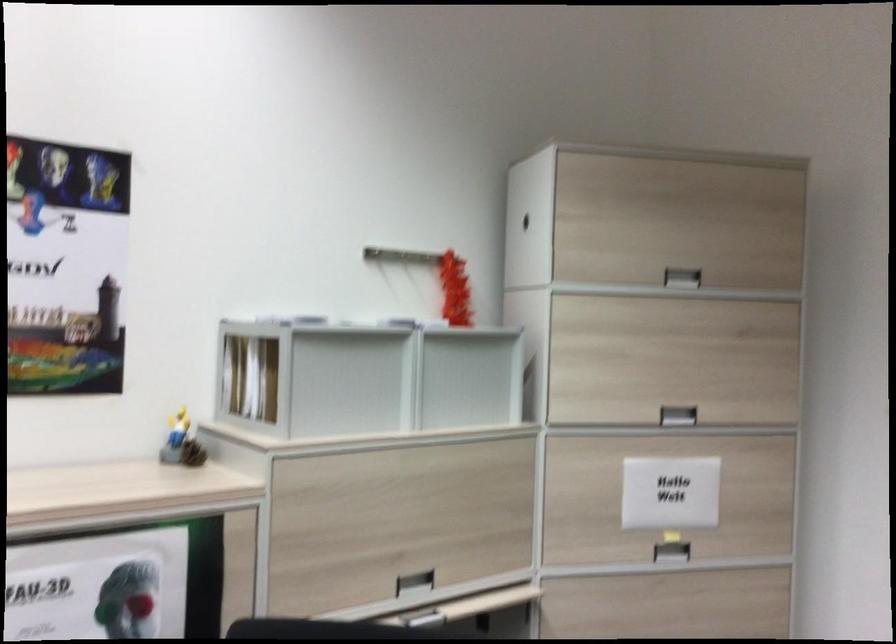
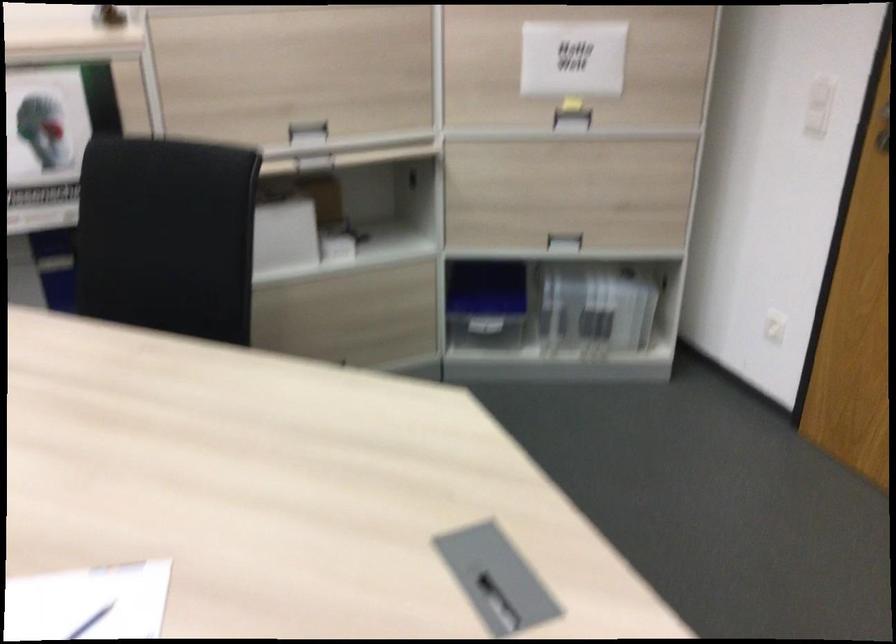
Question: I am providing you with two images of the same scene from different viewpoints. After the viewpoint changes to image2, which objects are now occluded?

Choices:
 (A) clear plastic container
 (B) blue plastic container
 (C) white box
 (D) none of these

Answer: (D)